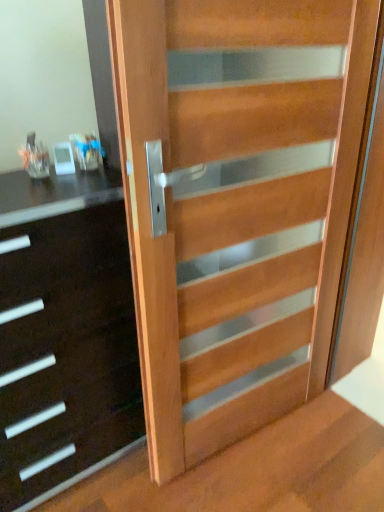
What is the approximate width of natural wood door at center?

natural wood door at center is 4.72 inches wide.

Image resolution: width=384 pixels, height=512 pixels. Describe the element at coordinates (66, 353) in the screenshot. I see `black glossy chest of drawers at left` at that location.

Locate an element on the screen. wooden stairwell at lower right is located at coordinates (256, 470).

Does wooden stairwell at lower right come behind black glossy chest of drawers at left?

No, wooden stairwell at lower right is in front of black glossy chest of drawers at left.

Which is behind, point (286, 493) or point (83, 362)?

Point (286, 493)

Which object is positioned more to the left, wooden stairwell at lower right or black glossy chest of drawers at left?

black glossy chest of drawers at left is more to the left.

Is wooden stairwell at lower right next to black glossy chest of drawers at left and touching it?

wooden stairwell at lower right and black glossy chest of drawers at left are not in contact.

Is black glossy chest of drawers at left oriented towards natural wood door at center?

No.

From the image's perspective, which object appears higher, black glossy chest of drawers at left or natural wood door at center?

natural wood door at center appears higher in the image.

How many degrees apart are the facing directions of black glossy chest of drawers at left and natural wood door at center?

4.38 degrees.

Between black glossy chest of drawers at left and natural wood door at center, which one has larger width?

Wider between the two is black glossy chest of drawers at left.

Between natural wood door at center and black glossy chest of drawers at left, which one appears on the right side from the viewer's perspective?

Positioned to the right is natural wood door at center.

Is natural wood door at center spatially inside black glossy chest of drawers at left, or outside of it?

natural wood door at center is located beyond the bounds of black glossy chest of drawers at left.

The image size is (384, 512). Identify the location of door in front of the black glossy chest of drawers at left. (235, 203).

Which of these two, natural wood door at center or black glossy chest of drawers at left, stands taller?

natural wood door at center.

Is wooden stairwell at lower right situated inside natural wood door at center or outside?

wooden stairwell at lower right is not inside natural wood door at center, it's outside.

Considering the relative positions of wooden stairwell at lower right and natural wood door at center in the image provided, is wooden stairwell at lower right to the right of natural wood door at center from the viewer's perspective?

In fact, wooden stairwell at lower right is to the left of natural wood door at center.

Where is `door that is above the wooden stairwell at lower right (from a real-world perspective)`? The width and height of the screenshot is (384, 512). door that is above the wooden stairwell at lower right (from a real-world perspective) is located at coordinates (235, 203).

From the image's perspective, is wooden stairwell at lower right beneath natural wood door at center?

Indeed, from the image's perspective, wooden stairwell at lower right is shown beneath natural wood door at center.

Is black glossy chest of drawers at left turned away from wooden stairwell at lower right?

That's not correct — black glossy chest of drawers at left is not looking away from wooden stairwell at lower right.

From the image's perspective, is black glossy chest of drawers at left located above or below wooden stairwell at lower right?

Based on their image positions, black glossy chest of drawers at left is located above wooden stairwell at lower right.

You are a GUI agent. You are given a task and a screenshot of the screen. Output one action in this format:
    pyautogui.click(x=<x>, y=<y>)
    Task: Click on the stairwell on the right side of black glossy chest of drawers at left
    The image size is (384, 512).
    Given the screenshot: What is the action you would take?
    pyautogui.click(x=256, y=470)

Is point (39, 481) closer to viewer compared to point (249, 472)?

Yes, point (39, 481) is closer to viewer.

Considering the sizes of natural wood door at center and wooden stairwell at lower right in the image, is natural wood door at center wider or thinner than wooden stairwell at lower right?

In the image, natural wood door at center appears to be more narrow than wooden stairwell at lower right.

How different are the orientations of natural wood door at center and wooden stairwell at lower right in degrees?

The facing directions of natural wood door at center and wooden stairwell at lower right are 94.5 degrees apart.

Can you confirm if natural wood door at center is bigger than wooden stairwell at lower right?

Correct, natural wood door at center is larger in size than wooden stairwell at lower right.

Which is farther from the camera, (194, 234) or (208, 476)?

The point (208, 476) is farther.

Where is `stairwell that is in front of the black glossy chest of drawers at left`? The image size is (384, 512). stairwell that is in front of the black glossy chest of drawers at left is located at coordinates (256, 470).

Locate an element on the screen. The height and width of the screenshot is (512, 384). door located on the right of black glossy chest of drawers at left is located at coordinates click(235, 203).

Estimate the real-world distances between objects in this image. Which object is further from black glossy chest of drawers at left, natural wood door at center or wooden stairwell at lower right?

Among the two, wooden stairwell at lower right is located further to black glossy chest of drawers at left.

Looking at the image, which one is located further to black glossy chest of drawers at left, wooden stairwell at lower right or natural wood door at center?

wooden stairwell at lower right lies further to black glossy chest of drawers at left than the other object.

Estimate the real-world distances between objects in this image. Which object is further from wooden stairwell at lower right, natural wood door at center or black glossy chest of drawers at left?

The object further to wooden stairwell at lower right is natural wood door at center.

Which object lies further to the anchor point natural wood door at center, black glossy chest of drawers at left or wooden stairwell at lower right?

wooden stairwell at lower right.

Which object lies nearer to the anchor point natural wood door at center, wooden stairwell at lower right or black glossy chest of drawers at left?

black glossy chest of drawers at left is positioned closer to the anchor natural wood door at center.

Estimate the real-world distances between objects in this image. Which object is further from wooden stairwell at lower right, black glossy chest of drawers at left or natural wood door at center?

natural wood door at center is further to wooden stairwell at lower right.

Find the location of a particular element. The width and height of the screenshot is (384, 512). chest of drawers between natural wood door at center and wooden stairwell at lower right in the vertical direction is located at coordinates (66, 353).